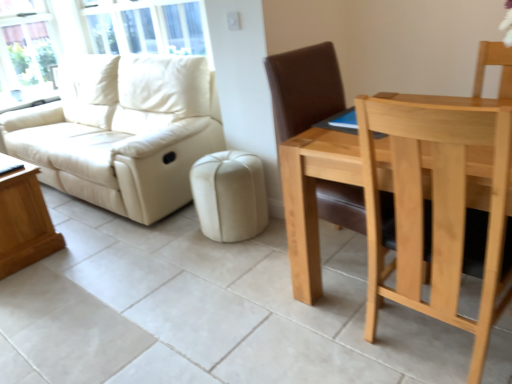
Locate an element on the screen. The width and height of the screenshot is (512, 384). matte cream leather couch at left is located at coordinates (122, 132).

Identify the location of light brown wooden coffee table at lower left. The width and height of the screenshot is (512, 384). (24, 220).

Between beige leather ottoman at center and light brown wooden coffee table at lower left, which one has smaller width?

beige leather ottoman at center is thinner.

Which is more to the right, beige leather ottoman at center or light brown wooden coffee table at lower left?

Positioned to the right is beige leather ottoman at center.

Based on their sizes in the image, would you say beige leather ottoman at center is bigger or smaller than light brown wooden coffee table at lower left?

Considering their sizes, beige leather ottoman at center takes up less space than light brown wooden coffee table at lower left.

Is beige leather ottoman at center closer to the viewer compared to light brown wooden coffee table at lower left?

No, beige leather ottoman at center is further to the viewer.

Looking at this image, are light brown wooden coffee table at lower left and light brown wood chair at right far apart?

light brown wooden coffee table at lower left is far away from light brown wood chair at right.

Is light brown wooden coffee table at lower left wider or thinner than light brown wood chair at right?

In the image, light brown wooden coffee table at lower left appears to be more narrow than light brown wood chair at right.

Consider the image. From the image's perspective, which is above, light brown wooden coffee table at lower left or light brown wood chair at right?

From the image's view, light brown wooden coffee table at lower left is above.

Choose the correct answer: Is light brown wood chair at right inside beige leather ottoman at center or outside it?

light brown wood chair at right is spatially situated outside beige leather ottoman at center.

Is point (461, 273) behind point (248, 163)?

No, (461, 273) is in front of (248, 163).

Can you confirm if light brown wood chair at right is shorter than beige leather ottoman at center?

No, light brown wood chair at right is not shorter than beige leather ottoman at center.

From a real-world perspective, who is located lower, light brown wood chair at right or beige leather ottoman at center?

beige leather ottoman at center.

Based on the photo, could matte cream leather couch at left be considered to be inside transparent glass window at upper left?

No, matte cream leather couch at left is not a part of transparent glass window at upper left.

Considering the sizes of objects transparent glass window at upper left and matte cream leather couch at left in the image provided, who is bigger, transparent glass window at upper left or matte cream leather couch at left?

matte cream leather couch at left is bigger.

Are transparent glass window at upper left and matte cream leather couch at left located far from each other?

No, transparent glass window at upper left is not far away from matte cream leather couch at left.

Is transparent glass window at upper left oriented towards matte cream leather couch at left?

No, transparent glass window at upper left is not oriented towards matte cream leather couch at left.

Can you confirm if light brown wooden coffee table at lower left is thinner than transparent glass window at upper left?

In fact, light brown wooden coffee table at lower left might be wider than transparent glass window at upper left.

Is point (24, 241) positioned in front of point (88, 3)?

Yes, point (24, 241) is closer to viewer.

Consider the image. Does light brown wooden coffee table at lower left turn towards transparent glass window at upper left?

No, light brown wooden coffee table at lower left is not aimed at transparent glass window at upper left.

Does light brown wooden coffee table at lower left have a greater height compared to transparent glass window at upper left?

No.

Is light brown wooden coffee table at lower left in front of matte cream leather couch at left?

Yes, light brown wooden coffee table at lower left is closer to the camera.

Would you say light brown wooden coffee table at lower left is inside or outside matte cream leather couch at left?

light brown wooden coffee table at lower left is spatially situated outside matte cream leather couch at left.

From the image's perspective, would you say light brown wooden coffee table at lower left is shown under matte cream leather couch at left?

Correct, light brown wooden coffee table at lower left appears lower than matte cream leather couch at left in the image.

Could you tell me if light brown wooden coffee table at lower left is facing matte cream leather couch at left?

No, light brown wooden coffee table at lower left is not aimed at matte cream leather couch at left.

Is matte cream leather couch at left located within beige leather ottoman at center?

No, matte cream leather couch at left is located outside of beige leather ottoman at center.

Considering the relative sizes of beige leather ottoman at center and matte cream leather couch at left in the image provided, is beige leather ottoman at center shorter than matte cream leather couch at left?

Yes, beige leather ottoman at center is shorter than matte cream leather couch at left.

Is beige leather ottoman at center wider than matte cream leather couch at left?

In fact, beige leather ottoman at center might be narrower than matte cream leather couch at left.

Identify the location of stool that is under the light brown wooden coffee table at lower left (from a real-world perspective). (230, 195).

You are a GUI agent. You are given a task and a screenshot of the screen. Output one action in this format:
    pyautogui.click(x=<x>, y=<y>)
    Task: Click on the table above the light brown wood chair at right (from the image's perspective)
    
    Given the screenshot: What is the action you would take?
    pyautogui.click(x=24, y=220)

From the picture: Considering their positions, is transparent glass window at upper left positioned closer to beige leather ottoman at center than light brown wood chair at right?

light brown wood chair at right.

Estimate the real-world distances between objects in this image. Which object is closer to light brown wooden coffee table at lower left, matte cream leather couch at left or light brown wood chair at right?

matte cream leather couch at left lies closer to light brown wooden coffee table at lower left than the other object.

Based on the photo, estimate the real-world distances between objects in this image. Which object is further from light brown wood chair at right, matte cream leather couch at left or light brown wooden coffee table at lower left?

Based on the image, light brown wooden coffee table at lower left appears to be further to light brown wood chair at right.

When comparing their distances from beige leather ottoman at center, does light brown wooden coffee table at lower left or matte cream leather couch at left seem closer?

The object closer to beige leather ottoman at center is matte cream leather couch at left.

Which object lies nearer to the anchor point matte cream leather couch at left, transparent glass window at upper left or beige leather ottoman at center?

transparent glass window at upper left is closer to matte cream leather couch at left.

Estimate the real-world distances between objects in this image. Which object is closer to transparent glass window at upper left, beige leather ottoman at center or matte cream leather couch at left?

Among the two, matte cream leather couch at left is located nearer to transparent glass window at upper left.

From the image, which object appears to be farther from light brown wood chair at right, transparent glass window at upper left or light brown wooden coffee table at lower left?

The object further to light brown wood chair at right is transparent glass window at upper left.

In the scene shown: Estimate the real-world distances between objects in this image. Which object is further from matte cream leather couch at left, light brown wooden coffee table at lower left or light brown wood chair at right?

light brown wood chair at right is positioned further to the anchor matte cream leather couch at left.

Where is `studio couch between transparent glass window at upper left and light brown wooden coffee table at lower left in the up-down direction`? Image resolution: width=512 pixels, height=384 pixels. studio couch between transparent glass window at upper left and light brown wooden coffee table at lower left in the up-down direction is located at coordinates (122, 132).

The height and width of the screenshot is (384, 512). Identify the location of studio couch between transparent glass window at upper left and beige leather ottoman at center in the vertical direction. (122, 132).

Where is `stool situated between light brown wooden coffee table at lower left and light brown wood chair at right from left to right`? The height and width of the screenshot is (384, 512). stool situated between light brown wooden coffee table at lower left and light brown wood chair at right from left to right is located at coordinates click(230, 195).

This screenshot has height=384, width=512. In order to click on window screen between matte cream leather couch at left and light brown wood chair at right in the horizontal direction in this screenshot , I will do `click(148, 27)`.